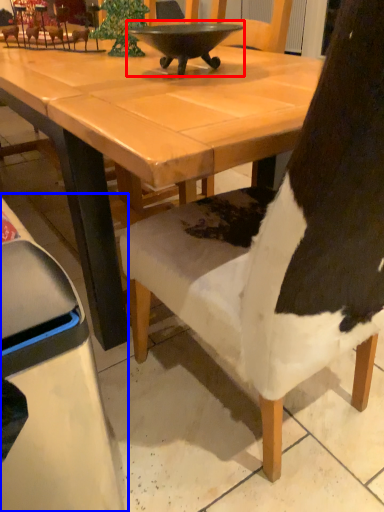
Question: Which object is further to the camera taking this photo, bowl (highlighted by a red box) or chair (highlighted by a blue box)?

Choices:
 (A) bowl
 (B) chair

Answer: (A)